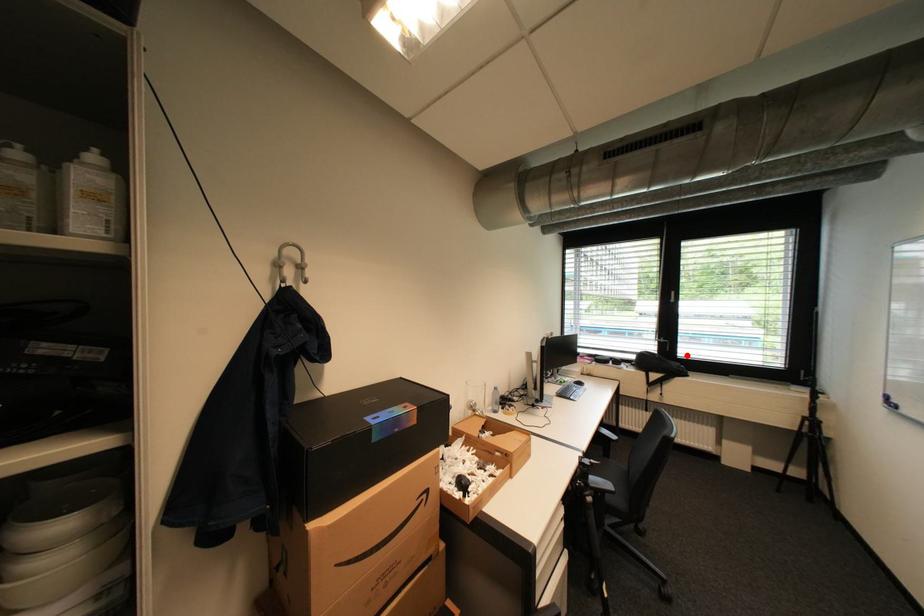
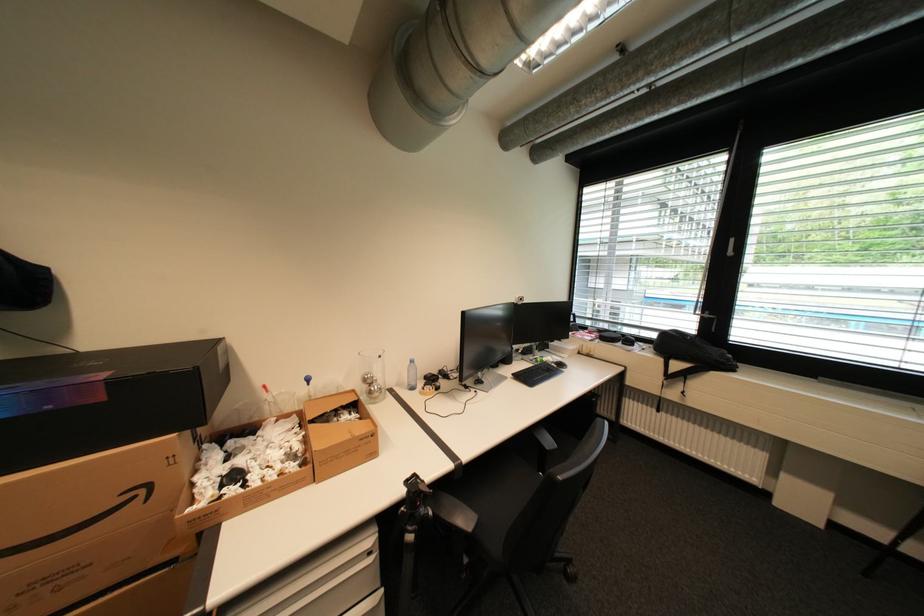
In the second image, find the point that corresponds to the highlighted location in the first image.

(739, 339)